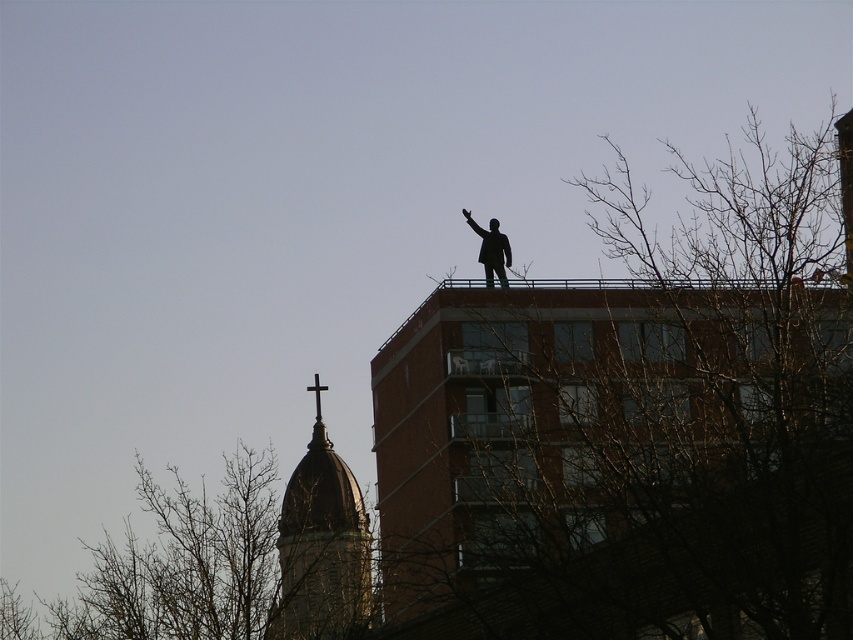
Where is `bare branches at upper center`? bare branches at upper center is located at coordinates (635, 424).

Image resolution: width=853 pixels, height=640 pixels. Describe the element at coordinates (635, 424) in the screenshot. I see `bare branches at upper center` at that location.

In order to click on bare branches at upper center in this screenshot , I will do `click(635, 424)`.

Can you confirm if dark brown stone tower at upper center is positioned above black matte statue at upper center?

No, dark brown stone tower at upper center is not above black matte statue at upper center.

In the scene shown: Measure the distance from dark brown stone tower at upper center to black matte statue at upper center.

dark brown stone tower at upper center is 29.82 meters away from black matte statue at upper center.

Between point (292, 490) and point (479, 257), which one is positioned in front?

Positioned in front is point (479, 257).

Identify the location of dark brown stone tower at upper center. (322, 545).

Which is above, dark brown stone tower at upper center or black matte hand at upper center?

black matte hand at upper center is above.

Which is behind, point (339, 577) or point (467, 211)?

The point (339, 577) is more distant.

Locate an element on the screen. dark brown stone tower at upper center is located at coordinates (322, 545).